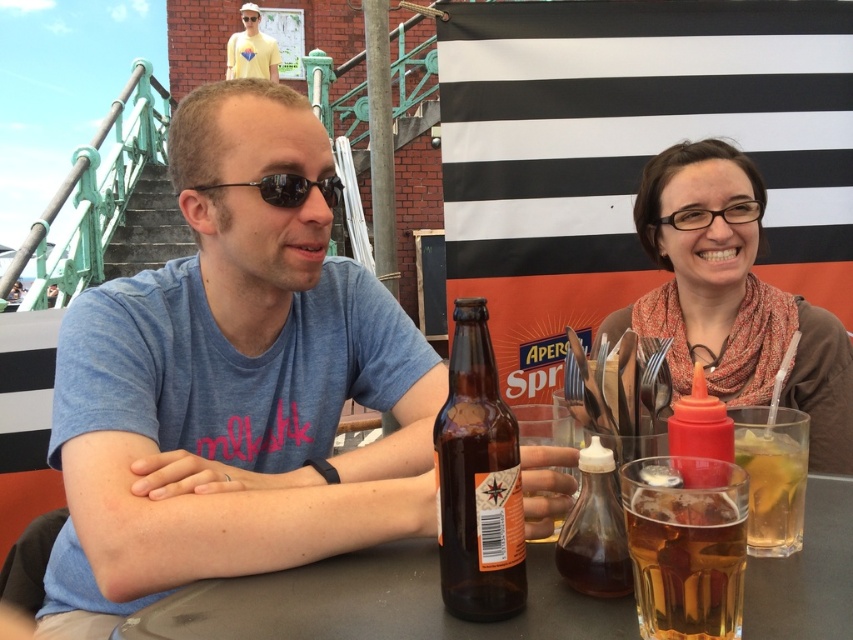
Question: Does matte brown scarf at upper right appear over sunglasses at center?

Choices:
 (A) yes
 (B) no

Answer: (B)

Question: Does translucent glass at center come behind yellow matte shirt at upper left?

Choices:
 (A) yes
 (B) no

Answer: (B)

Question: Which of the following is the closest to the observer?

Choices:
 (A) (482, 342)
 (B) (323, 189)
 (C) (614, 620)
 (D) (238, 56)

Answer: (C)

Question: Which object is the farthest from the brown glass bottle at center?

Choices:
 (A) matte blue t-shirt at center
 (B) yellow matte shirt at upper left
 (C) matte brown scarf at upper right

Answer: (B)

Question: Which point is closer to the camera?

Choices:
 (A) smooth gray table at center
 (B) translucent glass at center
 (C) matte blue t-shirt at center

Answer: (B)

Question: Is the position of brown glass bottle at center less distant than that of translucent glass bottle at center?

Choices:
 (A) yes
 (B) no

Answer: (A)